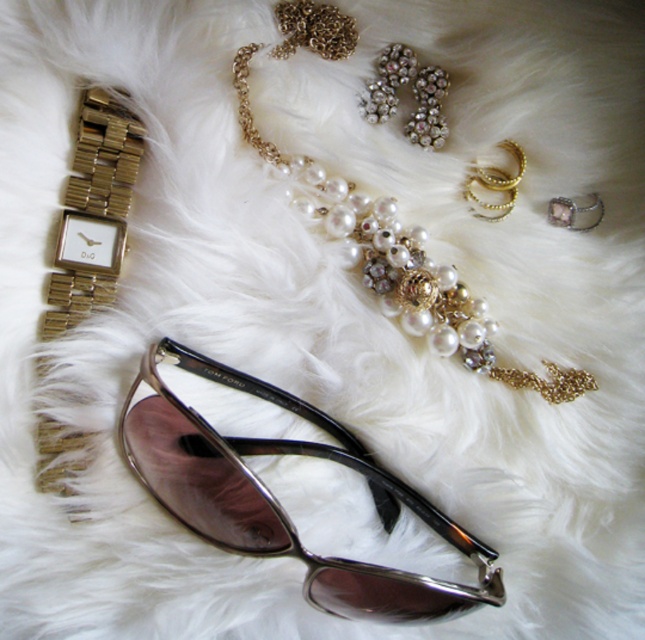
Question: Is metallic/smooth sunglasses at center thinner than gold metallic watch at left?

Choices:
 (A) no
 (B) yes

Answer: (A)

Question: Where is metallic/smooth sunglasses at center located in relation to gold metallic watch at left in the image?

Choices:
 (A) above
 (B) below

Answer: (B)

Question: Which point is closer to the camera?

Choices:
 (A) (384, 52)
 (B) (59, 266)
 (C) (557, 212)
 (D) (181, 515)

Answer: (D)

Question: Can you confirm if metallic/smooth sunglasses at center is thinner than pearl and gold chain at upper center?

Choices:
 (A) no
 (B) yes

Answer: (B)

Question: Which point is closer to the camera?

Choices:
 (A) (550, 209)
 (B) (61, 262)

Answer: (B)

Question: Which point is farther from the camera taking this photo?

Choices:
 (A) (590, 387)
 (B) (582, 209)
 (C) (37, 460)

Answer: (B)